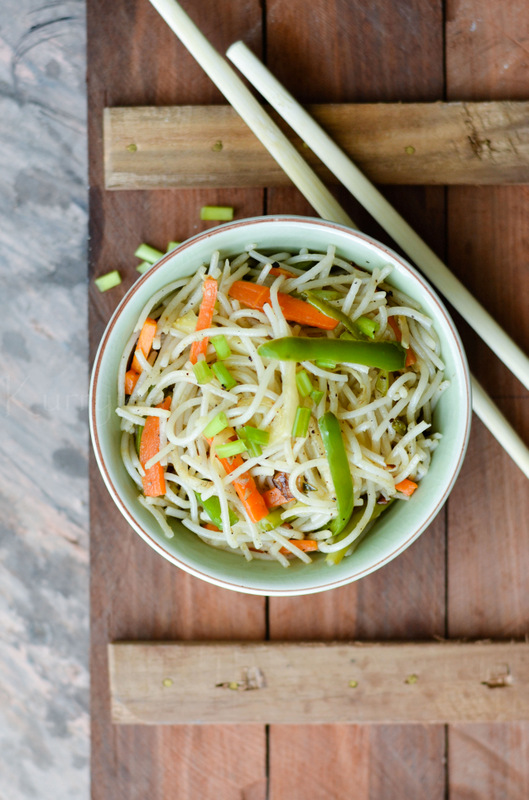
Identify the location of bowl. (390, 548).